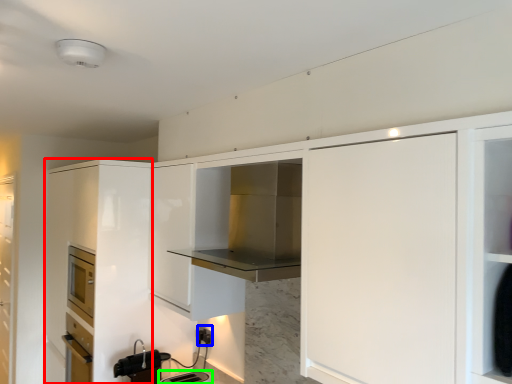
Question: Which object is the farthest from cabinetry (highlighted by a red box)? Choose among these: electric outlet (highlighted by a blue box) or appliance (highlighted by a green box).

Choices:
 (A) electric outlet
 (B) appliance

Answer: (B)